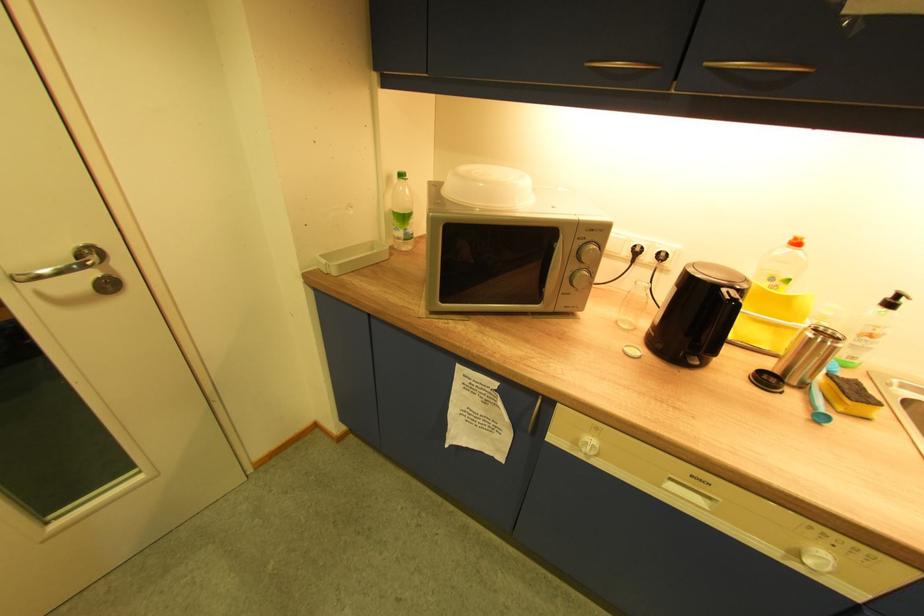
Find the location of `soap dispenser pump`. soap dispenser pump is located at coordinates (402, 213).